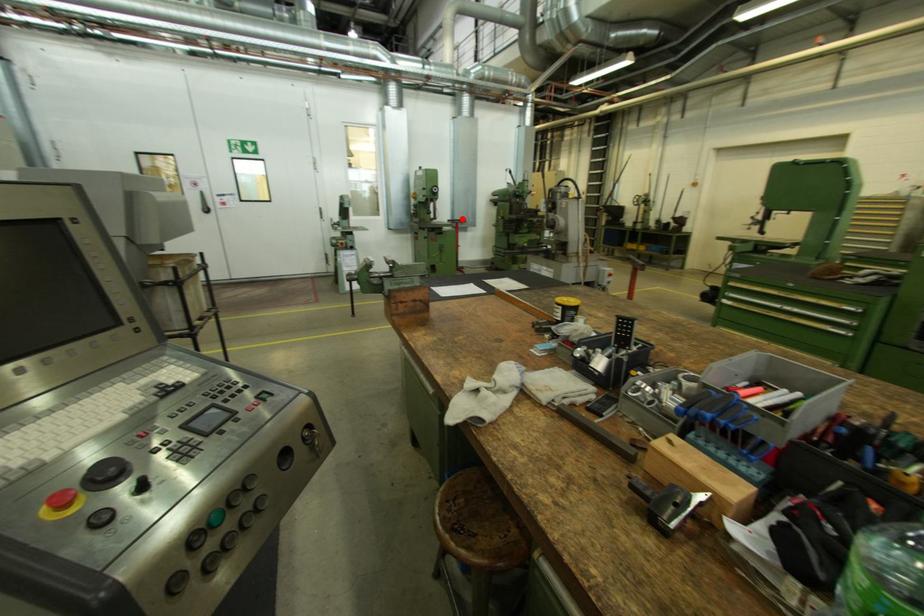
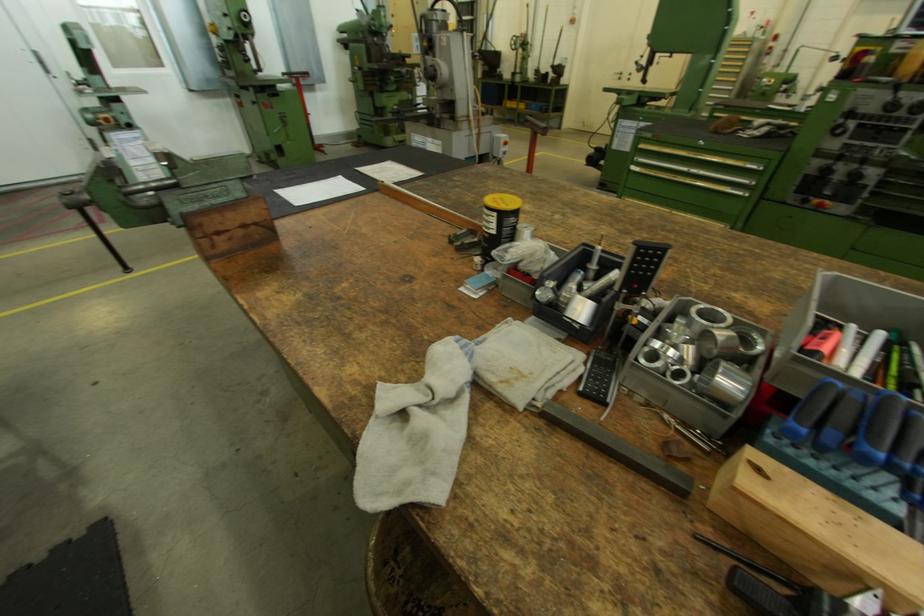
Question: I am providing you with two images of the same scene from different viewpoints. In image1, a red point is highlighted. Considering the same 3D point in image2, which of the following is correct?

Choices:
 (A) It is closer
 (B) It is farther

Answer: (B)